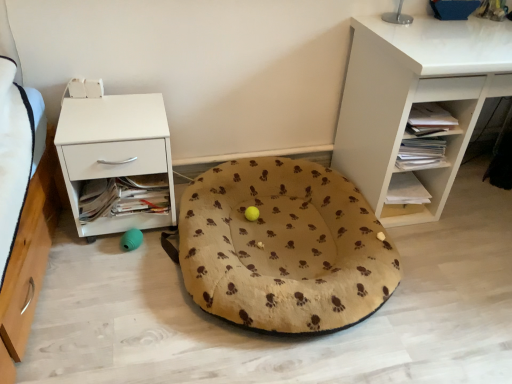
Identify the location of vacant region above white matte nightstand at left (from a real-world perspective). (114, 114).